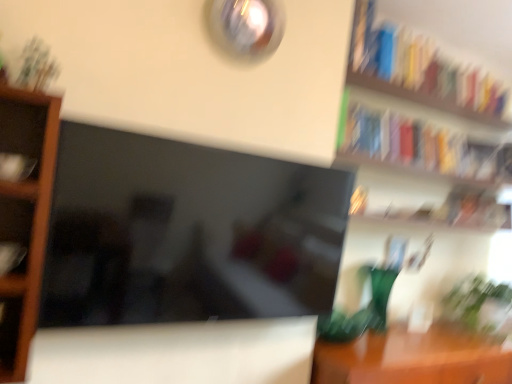
Question: Is brown wooden table at lower right taller or shorter than hardcover book at upper right, the 4th book from the left?

Choices:
 (A) short
 (B) tall

Answer: (B)

Question: Looking at their shapes, would you say brown wooden table at lower right is wider or thinner than hardcover book at upper right, the first book viewed from the right?

Choices:
 (A) thin
 (B) wide

Answer: (A)

Question: Which is farther from the matte black book at left, which ranks as the third book in right-to-left order?

Choices:
 (A) brown wooden shelf at left
 (B) brown wooden table at lower right
 (C) hardcover book at upper right, arranged as the first book when viewed from the top
 (D) matte black book at left, which is counted as the first book, starting from the left
 (E) hardcover book at upper right, arranged as the fourth book when viewed from the front

Answer: (C)

Question: Which object is positioned farthest from the green glass vase at right?

Choices:
 (A) hardcover book at upper right, positioned as the 2th book in right-to-left order
 (B) hardcover book at upper right, arranged as the first book when viewed from the top
 (C) green leafy plant at lower right
 (D) matte black book at left, positioned as the 4th book in back-to-front order
 (E) brown wooden table at lower right

Answer: (D)